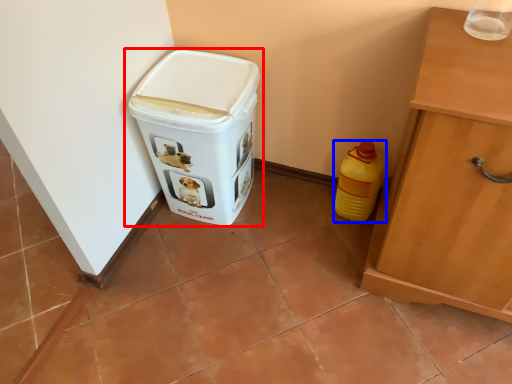
Question: Which of the following is the closest to the observer, waste container (highlighted by a red box) or bottle (highlighted by a blue box)?

Choices:
 (A) waste container
 (B) bottle

Answer: (A)